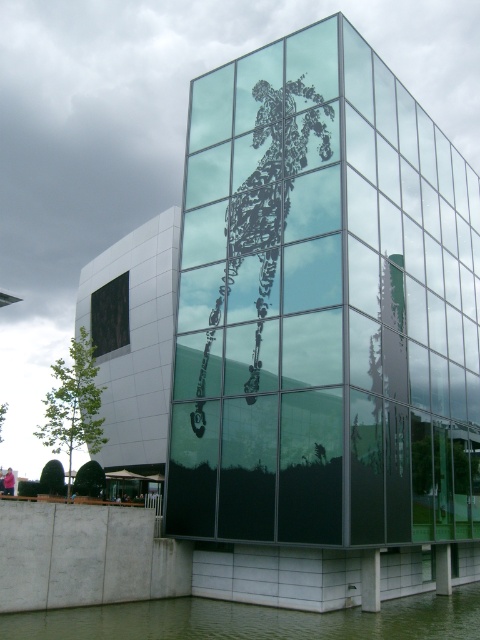
You are an interior designer who wants to hang a new artwork between the black glass window at lower left and the pink fabric mannequin at lower left. Based on their positions, where should you place the artwork to ensure it is centered between them?

The black glass window at lower left is above the pink fabric mannequin at lower left, so to center the artwork between them, place it halfway between their vertical positions.

You are standing at the entrance of the building and want to reach the black glass window at lower left without getting your shoes wet. The green liquid water at lower center is in your path. What is the minimum distance you need to walk around the water to reach the window?

The minimum distance you need to walk around the green liquid water at lower center to reach the black glass window at lower left is 28.54 meters.

You are standing in front of the building and see the green liquid water at lower center and the pink fabric mannequin at lower left. Which object is located to the right of the other?

The green liquid water at lower center is positioned on the right side of pink fabric mannequin at lower left.